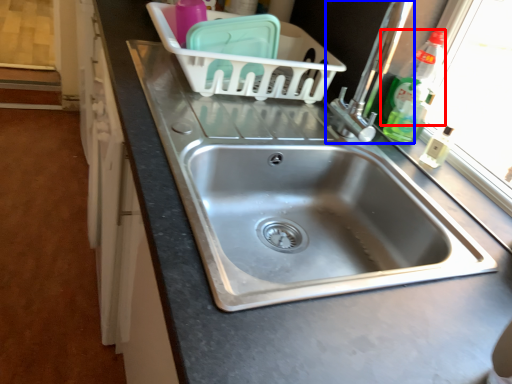
Question: Which point is closer to the camera, bottle (highlighted by a red box) or tap (highlighted by a blue box)?

Choices:
 (A) bottle
 (B) tap

Answer: (B)